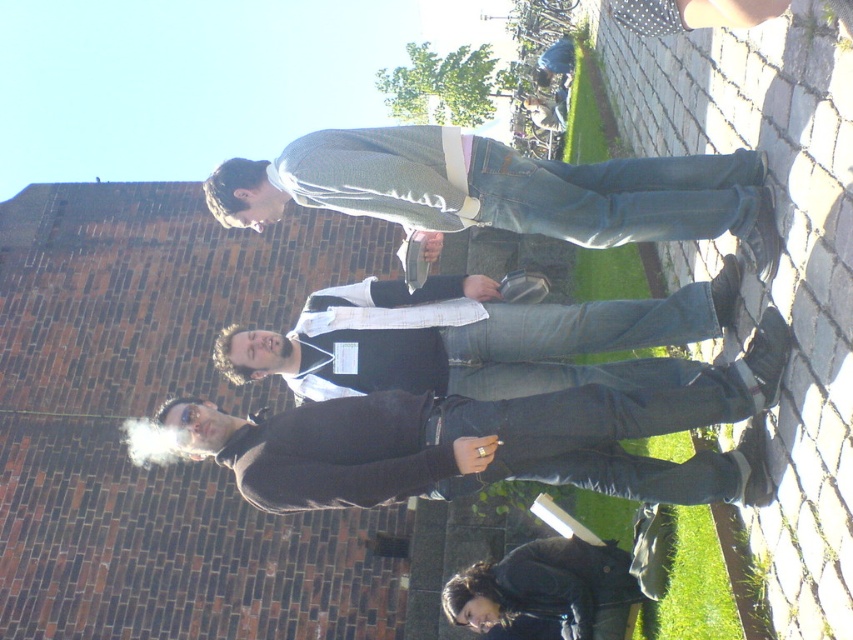
Question: Which point is closer to the camera taking this photo?

Choices:
 (A) (654, 332)
 (B) (416, 464)
 (C) (665, 564)
 (D) (289, 161)

Answer: (B)

Question: Which point is closer to the camera taking this photo?

Choices:
 (A) (498, 381)
 (B) (668, 394)
 (C) (527, 634)

Answer: (B)

Question: Can you confirm if denim jeans at center is positioned to the right of dark brown leather jacket at lower center?

Choices:
 (A) no
 (B) yes

Answer: (A)

Question: Is black matte jacket at center wider than black cotton shirt at center?

Choices:
 (A) yes
 (B) no

Answer: (A)

Question: Is denim jeans at center positioned in front of dark brown leather jacket at lower center?

Choices:
 (A) yes
 (B) no

Answer: (A)

Question: Which object is the closest to the dark brown leather jacket at lower center?

Choices:
 (A) denim jeans at center
 (B) black cotton shirt at center

Answer: (B)